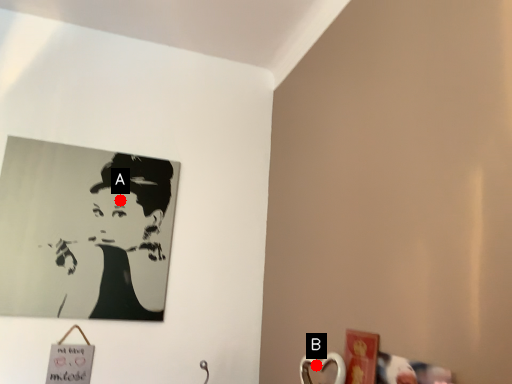
Question: Two points are circled on the image, labeled by A and B beside each circle. Which of the following is the farthest from the observer?

Choices:
 (A) A is further
 (B) B is further

Answer: (A)